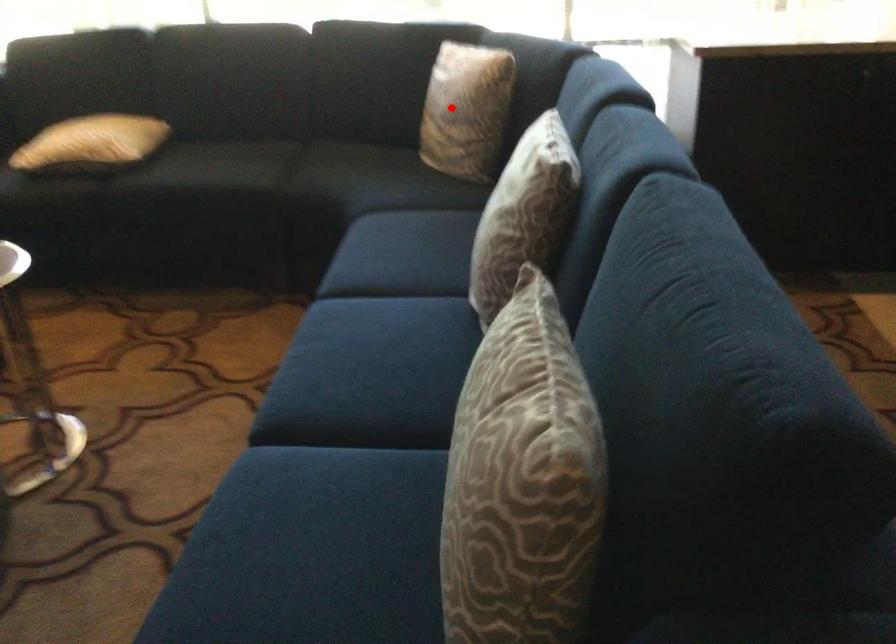
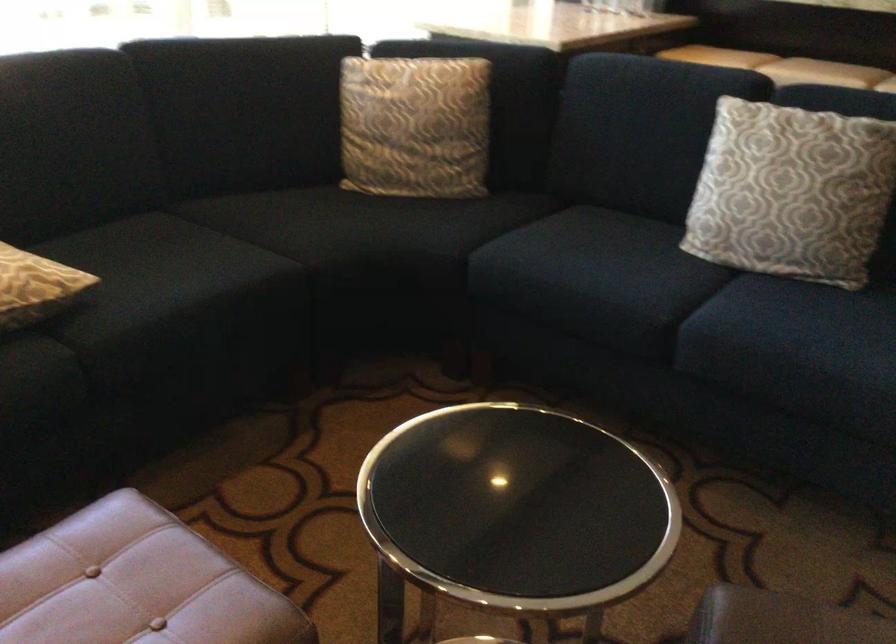
Where in the second image is the point corresponding to the highlighted location from the first image?

(415, 126)